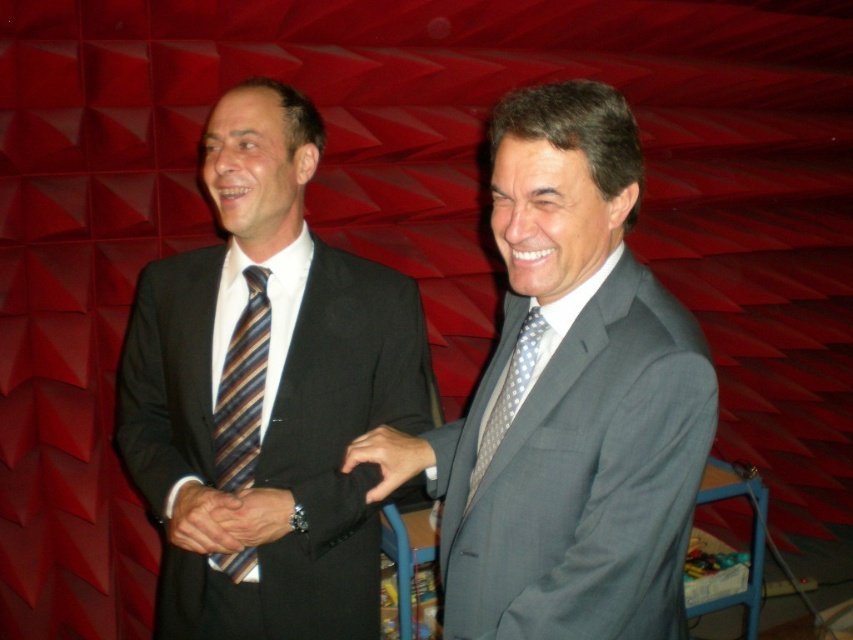
In the scene shown: Does gray textured suit at center come behind polka dot silk tie at center?

That is False.

Which is below, gray textured suit at center or polka dot silk tie at center?

polka dot silk tie at center is below.

At what (x,y) coordinates should I click in order to perform the action: click on gray textured suit at center. Please return your answer as a coordinate pair (x, y). The height and width of the screenshot is (640, 853). Looking at the image, I should click on (573, 397).

Does matte black suit at left have a smaller size compared to smooth brown leather hand at center?

Incorrect, matte black suit at left is not smaller in size than smooth brown leather hand at center.

Does matte black suit at left have a greater width compared to smooth brown leather hand at center?

Correct, the width of matte black suit at left exceeds that of smooth brown leather hand at center.

Who is more forward, [260,412] or [230,545]?

Point [230,545]

The image size is (853, 640). I want to click on matte black suit at left, so click(268, 387).

Between striped silk tie at left and matte black suit at center, which one has less height?

matte black suit at center is shorter.

Which is in front, point (257, 400) or point (402, 472)?

Point (402, 472)

Where is `striped silk tie at left`? striped silk tie at left is located at coordinates (242, 388).